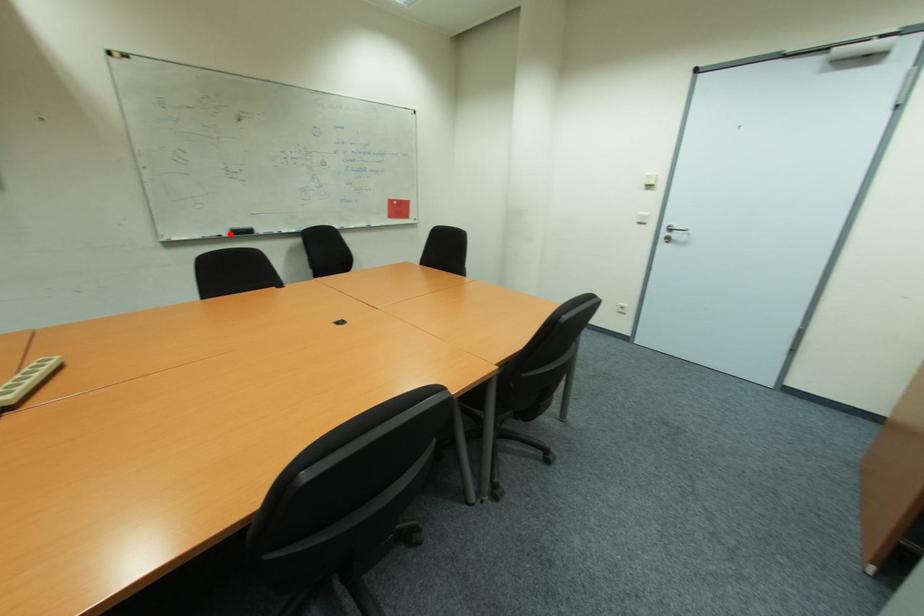
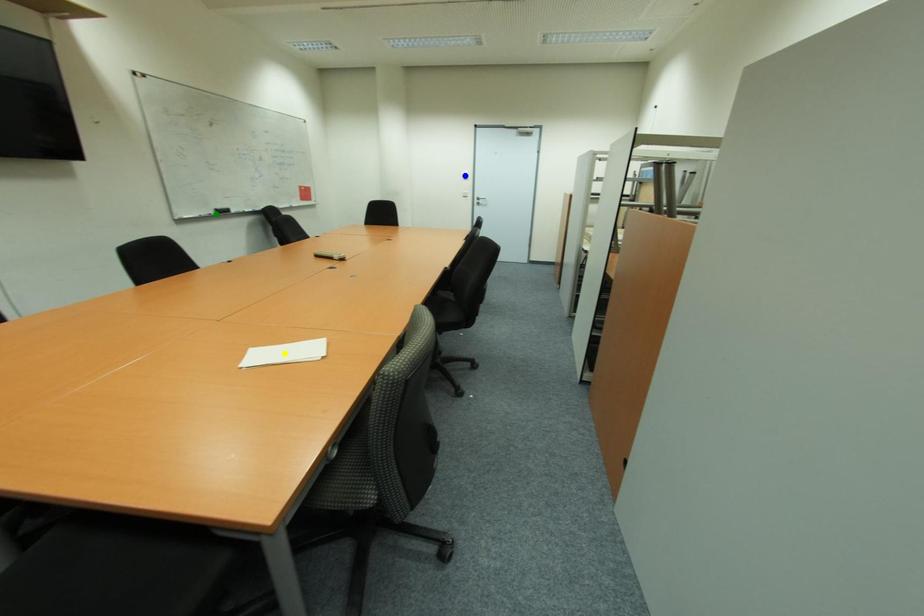
Question: I am providing you with two images of the same scene from different viewpoints. A red point is marked on the first image. You are given multiple points on the second image. Which spot in image 2 lines up with the point in image 1?

Choices:
 (A) yellow point
 (B) blue point
 (C) green point

Answer: (C)